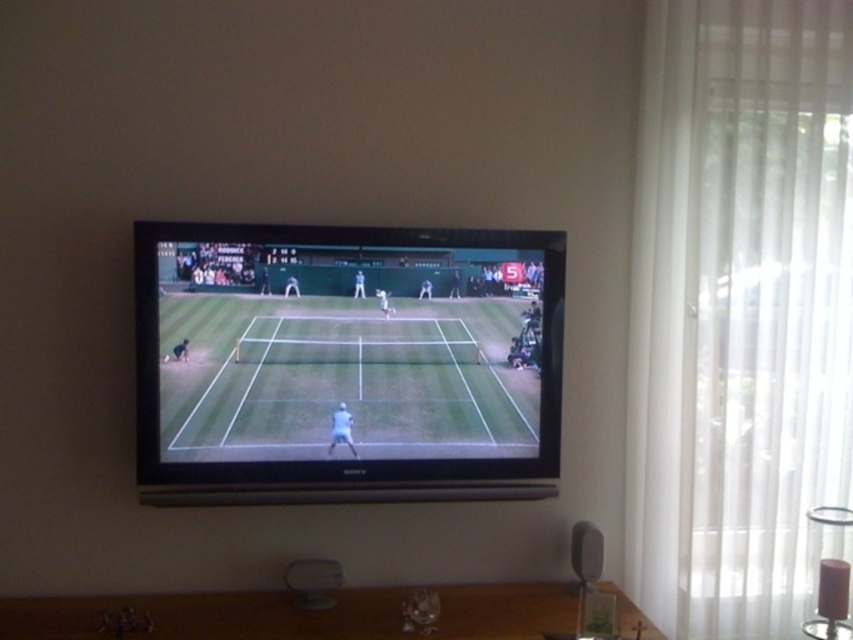
In the scene shown: How much distance is there between green grass tennis court at center and brown wooden table at lower center?

They are 21.27 inches apart.

Where is `green grass tennis court at center`? The width and height of the screenshot is (853, 640). green grass tennis court at center is located at coordinates (346, 364).

In order to click on green grass tennis court at center in this screenshot , I will do `click(346, 364)`.

Is white sheer curtain at right positioned behind green grass tennis court at center?

Yes, white sheer curtain at right is behind green grass tennis court at center.

Who is lower down, white sheer curtain at right or green grass tennis court at center?

Positioned lower is green grass tennis court at center.

Which is behind, point (683, 177) or point (165, 310)?

The point (683, 177) is more distant.

Locate an element on the screen. This screenshot has height=640, width=853. white sheer curtain at right is located at coordinates (740, 316).

Looking at this image, is white sheer curtain at right below brown wooden table at lower center?

Incorrect, white sheer curtain at right is not positioned below brown wooden table at lower center.

Is white sheer curtain at right positioned behind brown wooden table at lower center?

Yes, white sheer curtain at right is further from the viewer.

Where is `white sheer curtain at right`? The image size is (853, 640). white sheer curtain at right is located at coordinates (740, 316).

Identify the location of white sheer curtain at right. (740, 316).